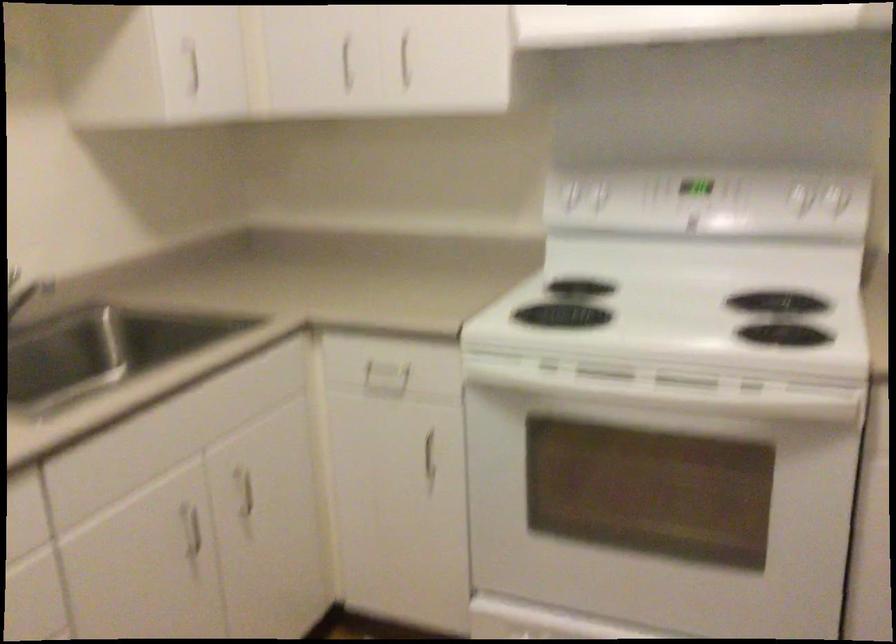
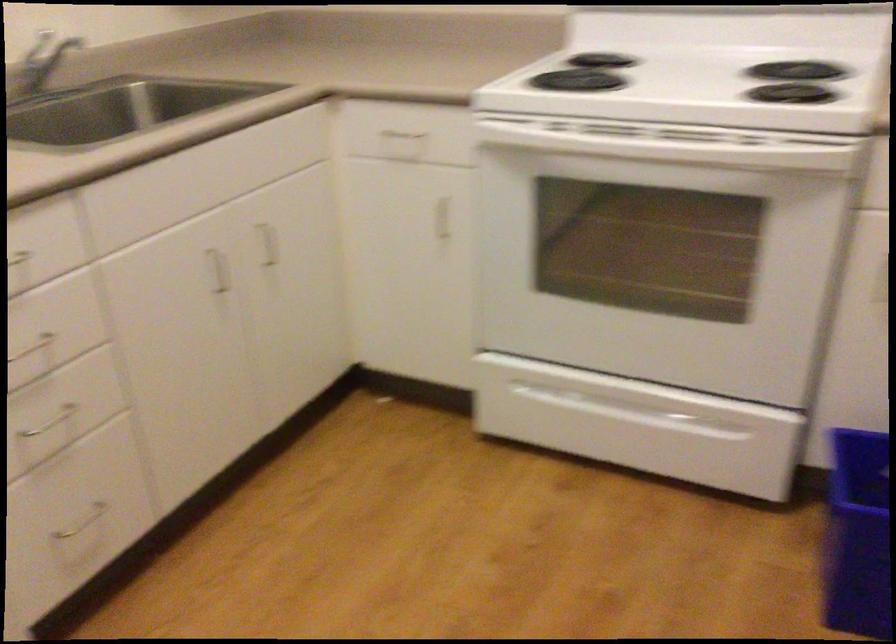
What movement of the cameraman would produce the second image?

The cameraman moved toward right, backward.